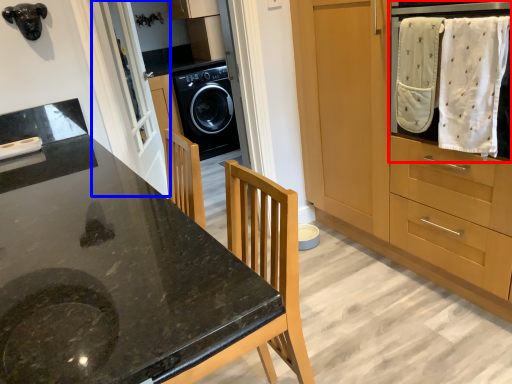
Question: Which object is further to the camera taking this photo, home appliance (highlighted by a red box) or screen door (highlighted by a blue box)?

Choices:
 (A) home appliance
 (B) screen door

Answer: (B)